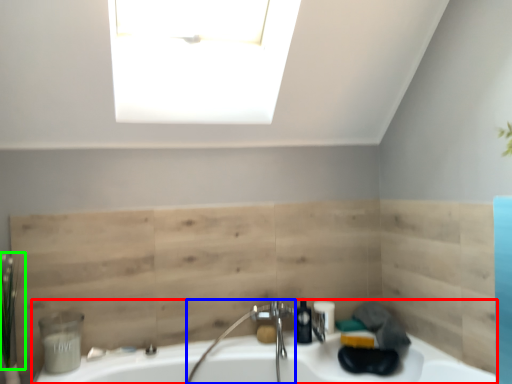
Question: Which object is positioned farthest from sink (highlighted by a red box)? Select from faucet (highlighted by a blue box) and plant (highlighted by a green box).

Choices:
 (A) faucet
 (B) plant

Answer: (B)